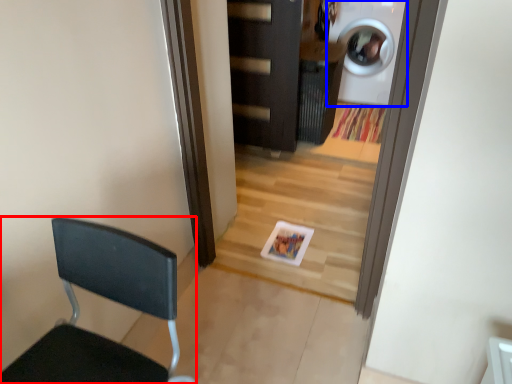
Question: Among these objects, which one is nearest to the camera, chair (highlighted by a red box) or washing machine (highlighted by a blue box)?

Choices:
 (A) chair
 (B) washing machine

Answer: (A)